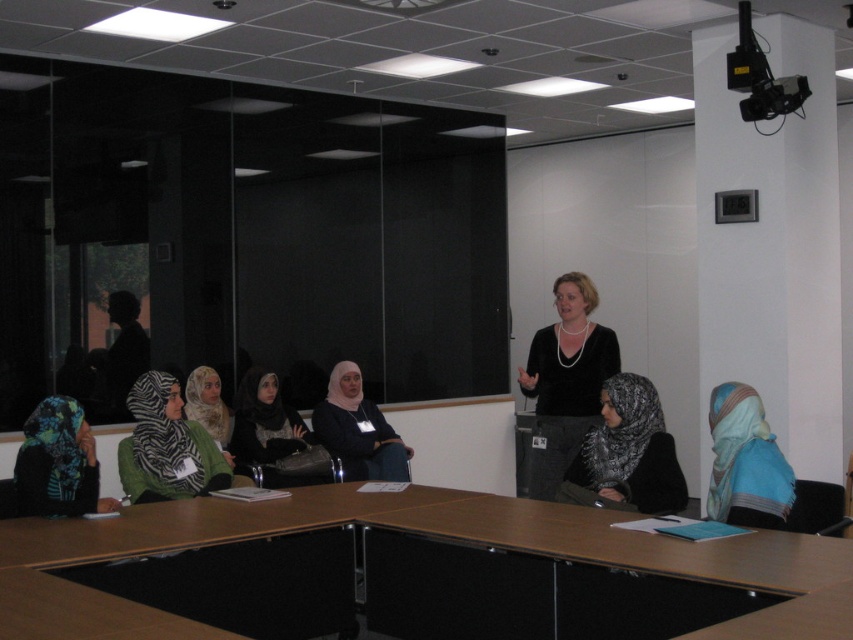
Can you confirm if brown wood table at center is positioned above blue silk hijab at lower right?

Incorrect, brown wood table at center is not positioned above blue silk hijab at lower right.

Can you confirm if brown wood table at center is thinner than blue silk hijab at lower right?

No, brown wood table at center is not thinner than blue silk hijab at lower right.

This screenshot has width=853, height=640. What do you see at coordinates (393, 532) in the screenshot?
I see `brown wood table at center` at bounding box center [393, 532].

This screenshot has height=640, width=853. Identify the location of brown wood table at center. (393, 532).

Is blue silk hijab at lower right positioned behind blue patterned scarf at lower left?

No, blue silk hijab at lower right is in front of blue patterned scarf at lower left.

Does blue silk hijab at lower right appear on the right side of blue patterned scarf at lower left?

Yes, blue silk hijab at lower right is to the right of blue patterned scarf at lower left.

Which is in front, point (715, 454) or point (27, 465)?

Point (27, 465) is in front.

Identify the location of blue silk hijab at lower right. The image size is (853, 640). (746, 461).

Is point (643, 499) farther from camera compared to point (218, 397)?

No, it is not.

Between black textured hijab at lower right and light beige scarf at center, which one is positioned lower?

light beige scarf at center is below.

Which is in front, point (596, 499) or point (207, 424)?

Point (596, 499)

Locate an element on the screen. The height and width of the screenshot is (640, 853). black textured hijab at lower right is located at coordinates (627, 452).